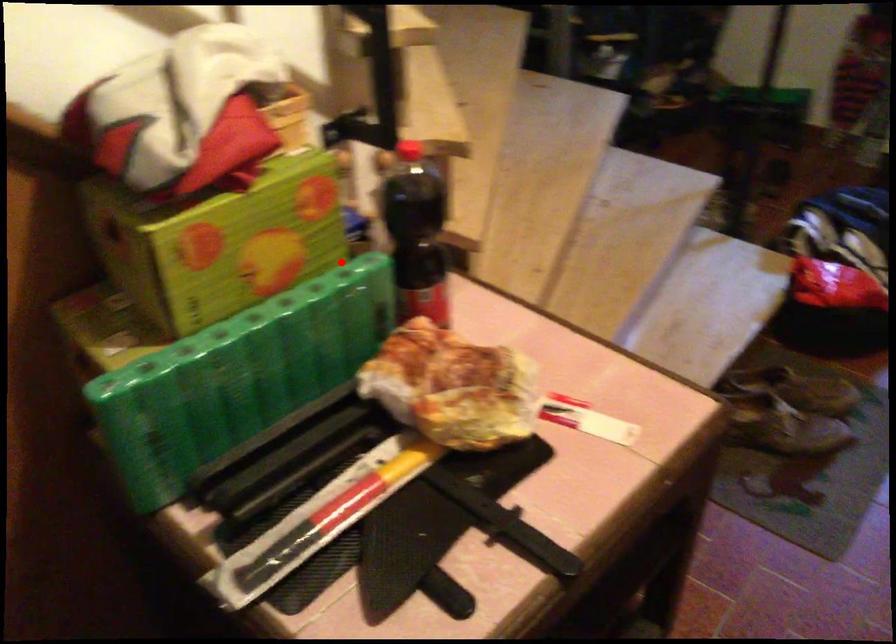
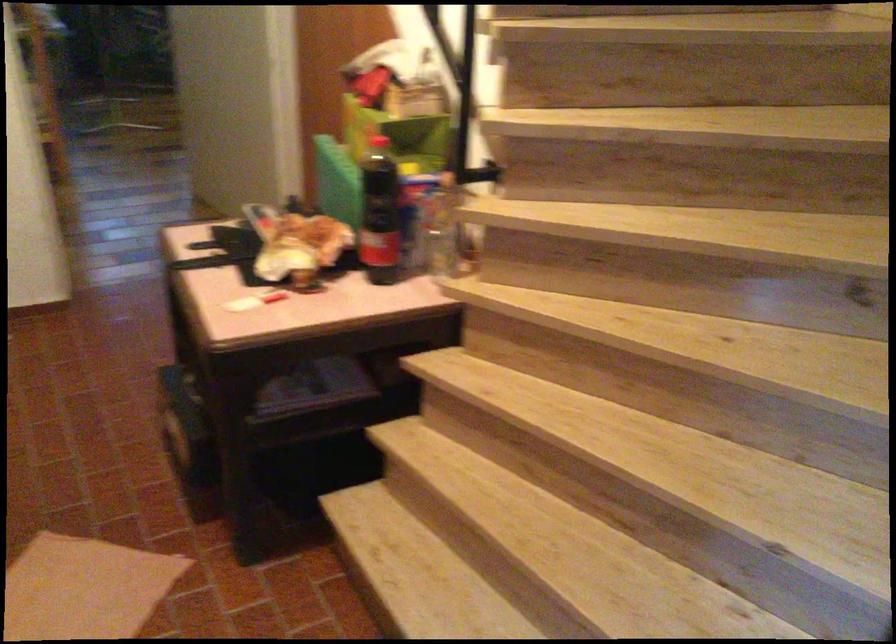
Question: I am providing you with two images of the same scene from different viewpoints. In image1, a red point is highlighted. Considering the same 3D point in image2, which of the following is correct?

Choices:
 (A) It is closer
 (B) It is farther

Answer: (B)